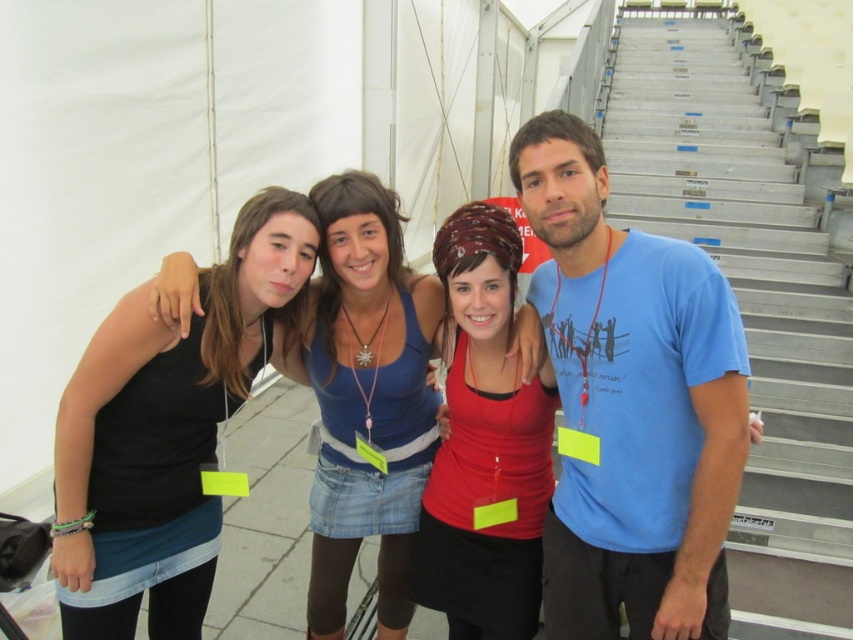
Does point (347, 474) lie in front of point (473, 595)?

No, (347, 474) is further to viewer.

Is blue denim skirt at center to the right of matte red tank top at center from the viewer's perspective?

Incorrect, blue denim skirt at center is not on the right side of matte red tank top at center.

Describe the element at coordinates (367, 397) in the screenshot. The height and width of the screenshot is (640, 853). I see `blue denim skirt at center` at that location.

Locate an element on the screen. The image size is (853, 640). blue denim skirt at center is located at coordinates coord(367,397).

Between blue cotton t-shirt at center and blue denim skirt at center, which one appears on the right side from the viewer's perspective?

blue cotton t-shirt at center is more to the right.

Does blue cotton t-shirt at center have a greater height compared to blue denim skirt at center?

In fact, blue cotton t-shirt at center may be shorter than blue denim skirt at center.

Does point (614, 406) lie in front of point (408, 538)?

Yes, it is in front of point (408, 538).

The height and width of the screenshot is (640, 853). Identify the location of blue cotton t-shirt at center. (631, 403).

Can you confirm if denim skirt at center is shorter than matte red tank top at center?

No.

Is denim skirt at center closer to the viewer compared to matte red tank top at center?

No, it is not.

Image resolution: width=853 pixels, height=640 pixels. I want to click on denim skirt at center, so click(372, 316).

In order to click on denim skirt at center in this screenshot , I will do `click(372, 316)`.